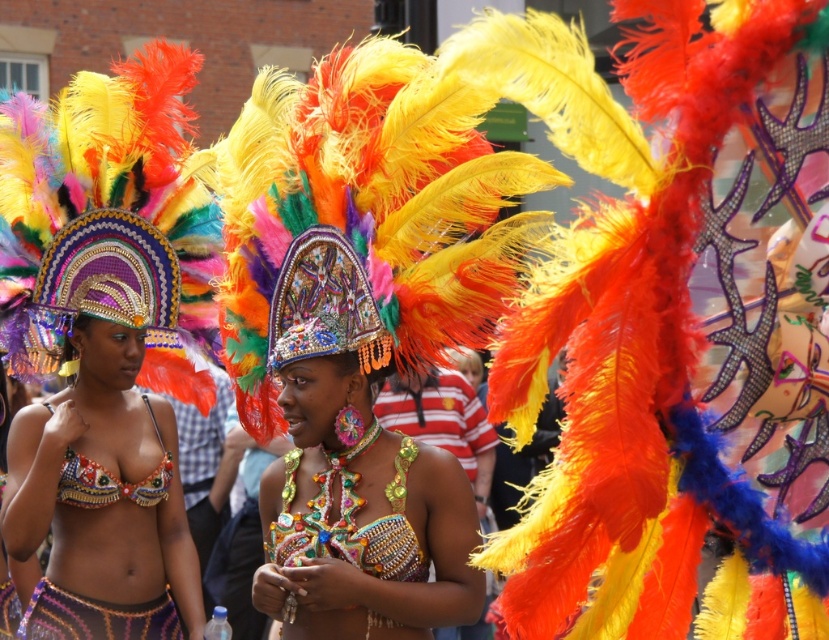
You are a photographer at the parade and want to capture a photo of both the shiny sequined costume at center and the multicolored sequined headdress at center. Which one should you focus on first if you want to include both in your frame without moving the camera?

The shiny sequined costume at center is positioned on the right side of the multicolored sequined headdress at center. Since the headdress is on the left, you should focus on the multicolored sequined headdress at center first to ensure both are in frame without moving the camera.

In the scene shown: You are a photographer trying to capture the best shot of the multicolored sequined headdress at center and the multicolored sequined bikini top at center. Since you want to focus on the headdress, which object should you adjust your camera to prioritize in terms of distance?

The multicolored sequined headdress at center is closer to the viewer than the multicolored sequined bikini top at center, so you should adjust your camera to prioritize focusing on the multicolored sequined headdress at center since it is nearer.